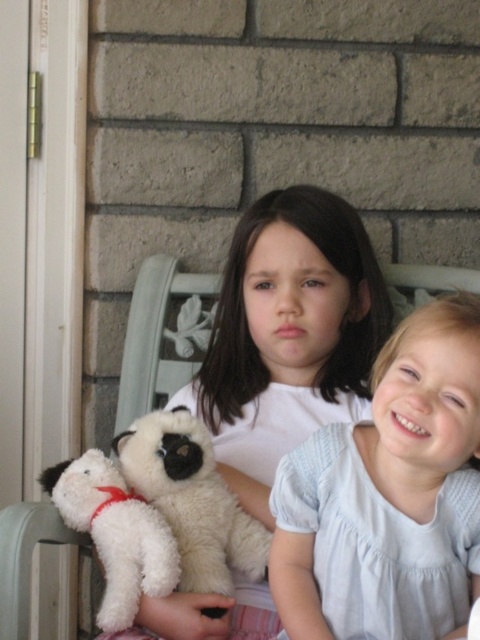
Question: Can you confirm if white cotton dress at center is positioned above white plush dog at center?

Choices:
 (A) no
 (B) yes

Answer: (B)

Question: Is white cotton dress at center below white plush dog at center?

Choices:
 (A) yes
 (B) no

Answer: (B)

Question: Which point is closer to the camera taking this photo?

Choices:
 (A) (381, 541)
 (B) (70, 512)

Answer: (A)

Question: Which of the following is the farthest from the observer?

Choices:
 (A) (179, 570)
 (B) (385, 394)

Answer: (A)

Question: Which of the following is the farthest from the observer?

Choices:
 (A) (96, 486)
 (B) (446, 476)

Answer: (A)

Question: Is white cotton dress at center in front of white plush dog at center?

Choices:
 (A) no
 (B) yes

Answer: (B)